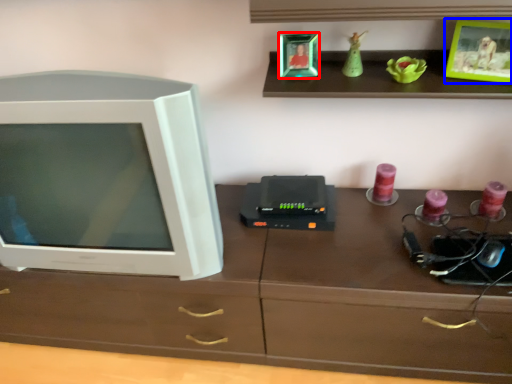
Question: Which object appears closest to the camera in this image, picture frame (highlighted by a red box) or picture frame (highlighted by a blue box)?

Choices:
 (A) picture frame
 (B) picture frame

Answer: (B)